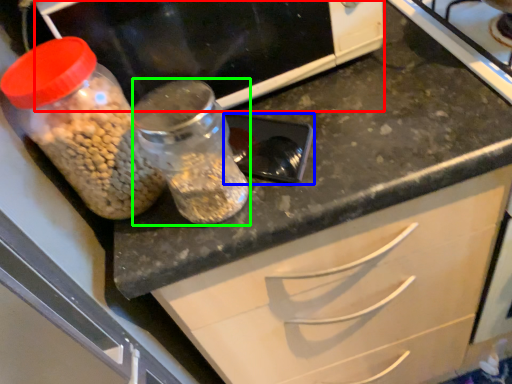
Question: Estimate the real-world distances between objects in this image. Which object is farther from wide (highlighted by a red box), appliance (highlighted by a blue box) or glass jar (highlighted by a green box)?

Choices:
 (A) appliance
 (B) glass jar

Answer: (B)